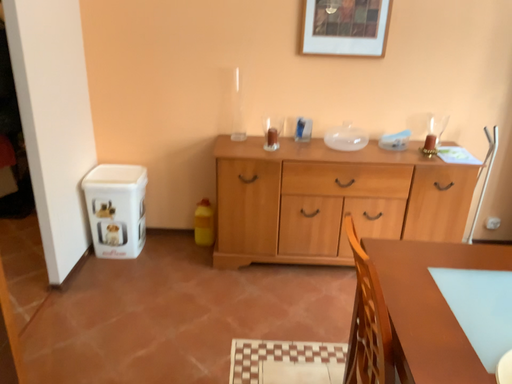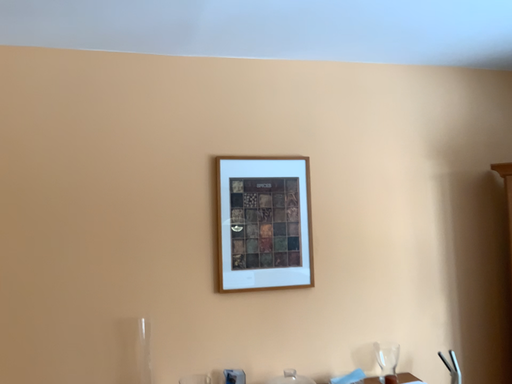
Question: Which way did the camera rotate in the video?

Choices:
 (A) rotated upward
 (B) rotated downward

Answer: (A)